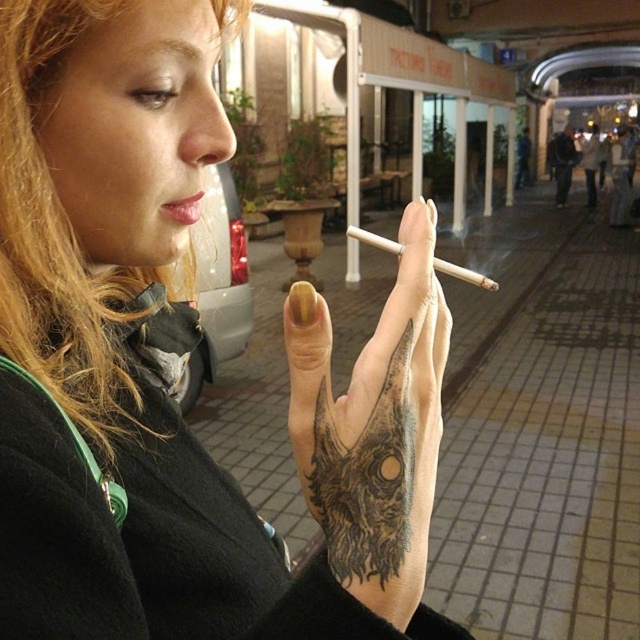
Does black tattooed hand at center appear on the right side of blonde hair at upper left?

Indeed, black tattooed hand at center is positioned on the right side of blonde hair at upper left.

This screenshot has height=640, width=640. Describe the element at coordinates (372, 428) in the screenshot. I see `black tattooed hand at center` at that location.

Where is `black tattooed hand at center`? The height and width of the screenshot is (640, 640). black tattooed hand at center is located at coordinates (372, 428).

Who is positioned more to the right, black ink tattoo at center or pink matte lips at center?

black ink tattoo at center

Can you confirm if black ink tattoo at center is smaller than pink matte lips at center?

Incorrect, black ink tattoo at center is not smaller in size than pink matte lips at center.

Does point (365, 547) come farther from viewer compared to point (196, 198)?

No, it is not.

Where is `black ink tattoo at center`? Image resolution: width=640 pixels, height=640 pixels. black ink tattoo at center is located at coordinates (365, 476).

Does point (381, 557) lie behind point (458, 268)?

No, it is in front of (458, 268).

Between black ink tattoo at center and white matte cigarette at center, which one has more height?

With more height is black ink tattoo at center.

Is point (324, 365) closer to viewer compared to point (465, 275)?

Yes, point (324, 365) is closer to viewer.

Locate an element on the screen. black ink tattoo at center is located at coordinates (365, 476).